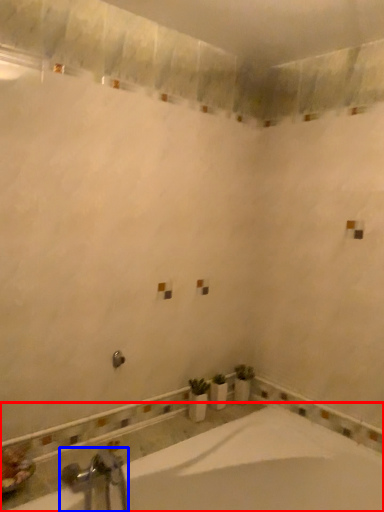
Question: Which of the following is the closest to the observer, bathtub (highlighted by a red box) or tap (highlighted by a blue box)?

Choices:
 (A) bathtub
 (B) tap

Answer: (A)